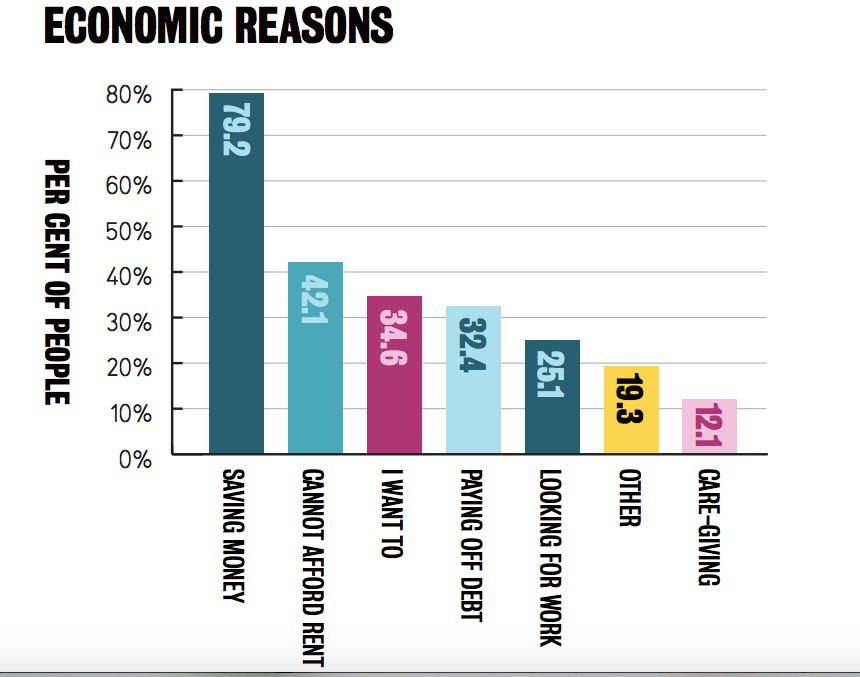
Where is `bar`? bar is located at coordinates (395, 403).